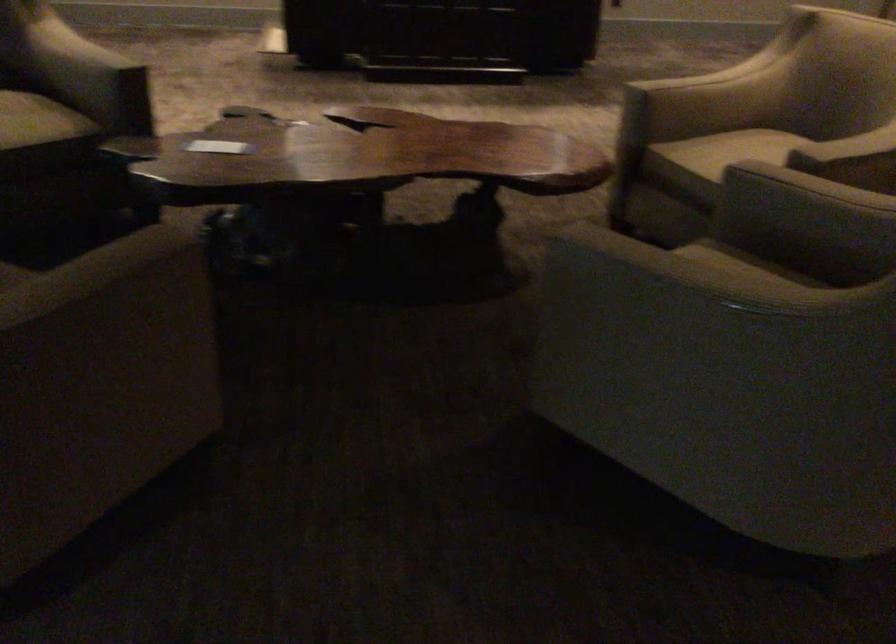
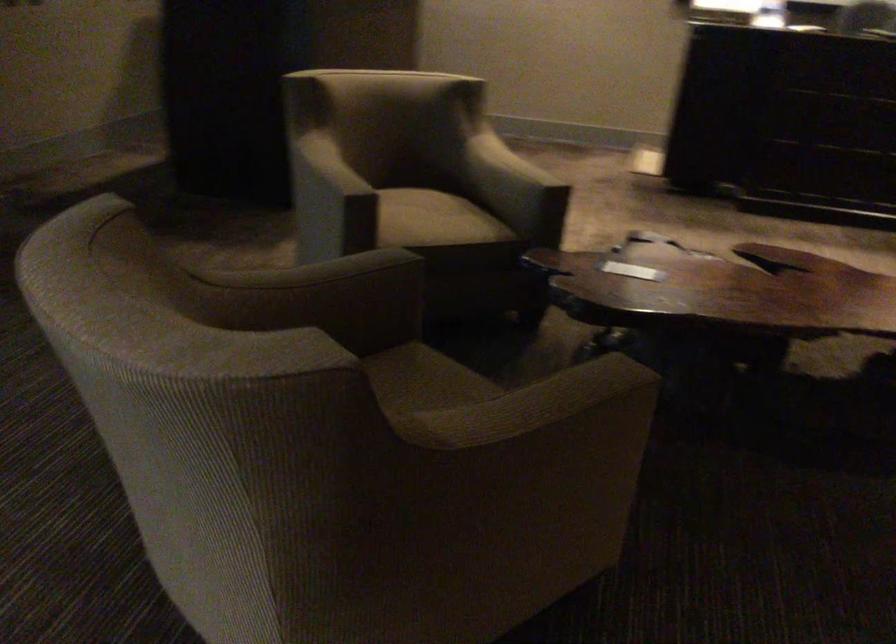
Question: The images are taken continuously from a first-person perspective. In which direction are you moving?

Choices:
 (A) Left
 (B) Right
 (C) Forward
 (D) Backward

Answer: (A)